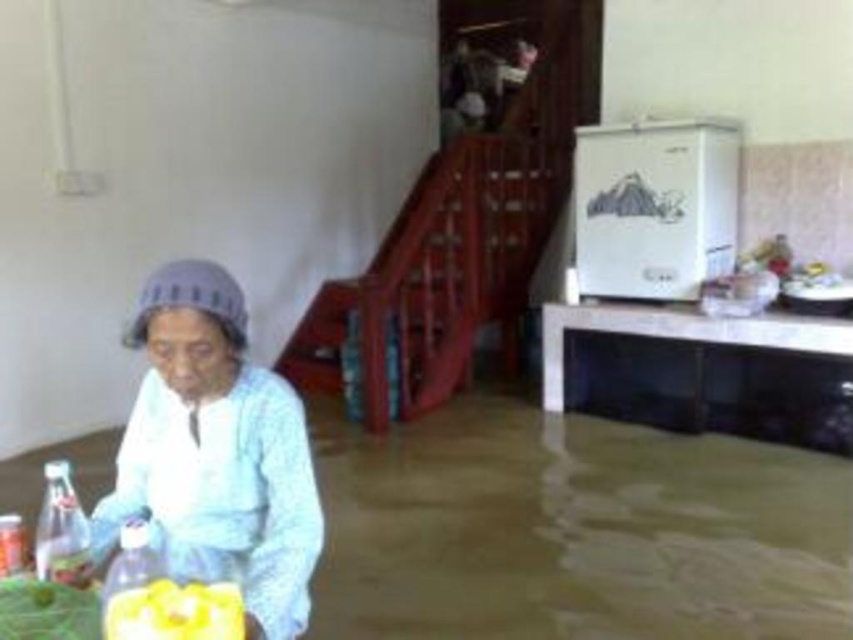
Question: Is white cotton shirt at lower left wider than white glossy table at lower right?

Choices:
 (A) no
 (B) yes

Answer: (A)

Question: Does white glossy table at lower right appear under yellow matte juice at lower left?

Choices:
 (A) no
 (B) yes

Answer: (B)

Question: Among these points, which one is nearest to the camera?

Choices:
 (A) (300, 426)
 (B) (167, 582)
 (C) (599, 344)

Answer: (B)

Question: Which of the following is the farthest from the observer?

Choices:
 (A) (229, 605)
 (B) (834, 333)

Answer: (B)

Question: Among these points, which one is farthest from the camera?

Choices:
 (A) (764, 426)
 (B) (277, 593)

Answer: (A)

Question: Does white cotton shirt at lower left appear under white glossy table at lower right?

Choices:
 (A) no
 (B) yes

Answer: (A)